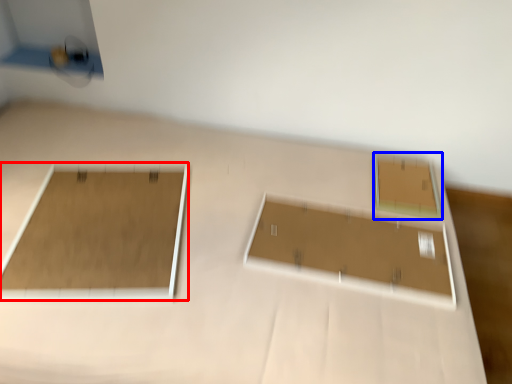
Question: Among these objects, which one is farthest to the camera, rectangle (highlighted by a red box) or rectangle (highlighted by a blue box)?

Choices:
 (A) rectangle
 (B) rectangle

Answer: (B)